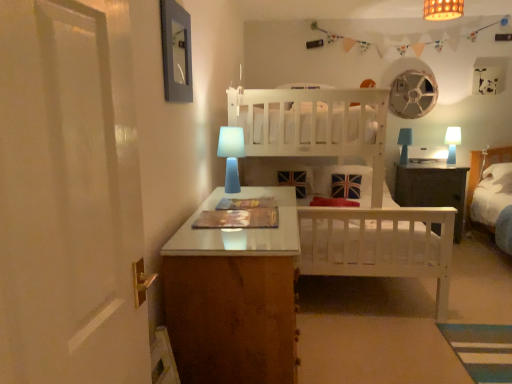
What is the approximate height of matte gray picture frame at upper left?

The height of matte gray picture frame at upper left is 16.38 inches.

Describe the element at coordinates (452, 143) in the screenshot. I see `blue matte table lamp at right, marked as the 1th table lamp in a right-to-left arrangement` at that location.

The width and height of the screenshot is (512, 384). What do you see at coordinates (442, 9) in the screenshot?
I see `bamboo lampshade at upper center` at bounding box center [442, 9].

What is the approximate height of blue matte table lamp at right, which is the second table lamp in right-to-left order?

It is 14.99 inches.

This screenshot has height=384, width=512. I want to click on blue matte table lamp at center, which appears as the first table lamp when viewed from the left, so click(x=231, y=155).

What are the coordinates of `white wooden bed at center` in the screenshot? It's located at (349, 208).

I want to click on white fabric pillow at right, so click(498, 178).

Considering the positions of objects white fabric pillow at right and blue matte table lamp at center, which appears as the first table lamp when viewed from the left, in the image provided, who is more to the right, white fabric pillow at right or blue matte table lamp at center, which appears as the first table lamp when viewed from the left,?

white fabric pillow at right is more to the right.

Which is behind, point (507, 170) or point (231, 177)?

Positioned behind is point (507, 170).

Starting from the bamboo lampshade at upper center, which table lamp is the 3rd one behind? Please provide its 2D coordinates.

[(404, 144)]

Would you consider blue matte table lamp at right, which is counted as the 2th table lamp, starting from the left, to be distant from bamboo lampshade at upper center?

Yes, blue matte table lamp at right, which is counted as the 2th table lamp, starting from the left, and bamboo lampshade at upper center are located far from each other.

Between point (407, 134) and point (446, 8), which one is positioned in front?

The point (446, 8) is in front.

Which of these two, blue matte table lamp at right, the first table lamp from the back, or white fabric pillow at right, stands shorter?

Standing shorter between the two is white fabric pillow at right.

Is blue matte table lamp at right, which is the second table lamp in right-to-left order, not near white fabric pillow at right?

That's right, there is a large distance between blue matte table lamp at right, which is the second table lamp in right-to-left order, and white fabric pillow at right.

Which object is positioned more to the left, blue matte table lamp at right, which is counted as the 2th table lamp, starting from the left, or white fabric pillow at right?

blue matte table lamp at right, which is counted as the 2th table lamp, starting from the left.

Considering the sizes of blue matte table lamp at right, which is the second table lamp in right-to-left order, and white fabric pillow at right in the image, is blue matte table lamp at right, which is the second table lamp in right-to-left order, wider or thinner than white fabric pillow at right?

blue matte table lamp at right, which is the second table lamp in right-to-left order, is thinner than white fabric pillow at right.

Is matte gray picture frame at upper left smaller than blue matte table lamp at right, which is the second table lamp in right-to-left order?

Yes.

From a real-world perspective, relative to blue matte table lamp at right, the first table lamp from the back, is matte gray picture frame at upper left vertically above or below?

matte gray picture frame at upper left is situated higher than blue matte table lamp at right, the first table lamp from the back, in the real world.

How much distance is there between matte gray picture frame at upper left and blue matte table lamp at right, the first table lamp from the back?

matte gray picture frame at upper left and blue matte table lamp at right, the first table lamp from the back, are 10.33 feet apart.

Is matte gray picture frame at upper left touching blue matte table lamp at right, which is counted as the 2th table lamp, starting from the left?

No, matte gray picture frame at upper left is not in contact with blue matte table lamp at right, which is counted as the 2th table lamp, starting from the left.

Which point is more forward, (236, 91) or (405, 150)?

Point (236, 91)

Can you confirm if white wooden bed at center is shorter than blue matte table lamp at right, which ranks as the third table lamp in front-to-back order?

No, white wooden bed at center is not shorter than blue matte table lamp at right, which ranks as the third table lamp in front-to-back order.

Is white wooden bed at center outside of blue matte table lamp at right, which ranks as the third table lamp in front-to-back order?

Yes, white wooden bed at center is outside of blue matte table lamp at right, which ranks as the third table lamp in front-to-back order.

Looking at this image, does white wooden bed at center have a smaller size compared to blue matte table lamp at right, which ranks as the third table lamp in front-to-back order?

Actually, white wooden bed at center might be larger than blue matte table lamp at right, which ranks as the third table lamp in front-to-back order.

Between blue matte table lamp at right, acting as the third table lamp starting from the left, and blue matte table lamp at right, the first table lamp from the back, which one has larger width?

blue matte table lamp at right, the first table lamp from the back, is wider.

Between blue matte table lamp at right, marked as the 1th table lamp in a right-to-left arrangement, and blue matte table lamp at right, which ranks as the third table lamp in front-to-back order, which one has larger size?

Bigger between the two is blue matte table lamp at right, which ranks as the third table lamp in front-to-back order.

Is blue matte table lamp at right, which is counted as the second table lamp, starting from the front, oriented towards blue matte table lamp at right, which ranks as the third table lamp in front-to-back order?

No.

Looking at this image, which is in front, blue matte table lamp at right, acting as the third table lamp starting from the left, or blue matte table lamp at right, which is the second table lamp in right-to-left order?

blue matte table lamp at right, acting as the third table lamp starting from the left, is closer to the camera.

From a real-world perspective, is white fabric pillow at right over blue matte table lamp at right, acting as the third table lamp starting from the left?

No, from a real-world perspective, white fabric pillow at right is not over blue matte table lamp at right, acting as the third table lamp starting from the left

Considering the sizes of objects white fabric pillow at right and blue matte table lamp at right, marked as the 1th table lamp in a right-to-left arrangement, in the image provided, who is taller, white fabric pillow at right or blue matte table lamp at right, marked as the 1th table lamp in a right-to-left arrangement,?

blue matte table lamp at right, marked as the 1th table lamp in a right-to-left arrangement.

From the image's perspective, would you say white fabric pillow at right is positioned over blue matte table lamp at right, which is counted as the second table lamp, starting from the front?

No.

Between point (501, 166) and point (449, 151), which one is positioned behind?

The point (501, 166) is more distant.

I want to click on pillow that is on the right side of blue matte table lamp at center, which appears as the first table lamp when viewed from the left, so click(498, 178).

I want to click on light fixture to the left of blue matte table lamp at right, which is the second table lamp in right-to-left order, so click(x=442, y=9).

From the image, which object appears to be nearer to blue matte table lamp at right, which ranks as the third table lamp in front-to-back order, blue matte table lamp at right, acting as the third table lamp starting from the left, or blue matte table lamp at center, acting as the 3th table lamp starting from the right?

The object closer to blue matte table lamp at right, which ranks as the third table lamp in front-to-back order, is blue matte table lamp at right, acting as the third table lamp starting from the left.

Based on their spatial positions, is blue matte table lamp at right, the first table lamp from the back, or blue matte table lamp at right, arranged as the second table lamp when viewed from the back, closer to matte gray picture frame at upper left?

blue matte table lamp at right, the first table lamp from the back, is positioned closer to the anchor matte gray picture frame at upper left.

Which object lies further to the anchor point white wooden bed at center, dark wood nightstand at center or bamboo lampshade at upper center?

bamboo lampshade at upper center is positioned further to the anchor white wooden bed at center.

Looking at the image, which one is located further to dark wood nightstand at center, white fabric pillow at right or bamboo lampshade at upper center?

bamboo lampshade at upper center lies further to dark wood nightstand at center than the other object.

Looking at the image, which one is located further to matte gray picture frame at upper left, bamboo lampshade at upper center or blue matte table lamp at right, which is counted as the 2th table lamp, starting from the left?

blue matte table lamp at right, which is counted as the 2th table lamp, starting from the left, is positioned further to the anchor matte gray picture frame at upper left.

Considering their positions, is bamboo lampshade at upper center positioned further to blue matte table lamp at right, the first table lamp from the back, than dark wood nightstand at center?

The object further to blue matte table lamp at right, the first table lamp from the back, is bamboo lampshade at upper center.

Considering their positions, is matte gray picture frame at upper left positioned further to white fabric pillow at right than blue matte table lamp at right, marked as the 1th table lamp in a right-to-left arrangement?

matte gray picture frame at upper left lies further to white fabric pillow at right than the other object.

Based on their spatial positions, is bamboo lampshade at upper center or blue matte table lamp at center, the third table lamp when ordered from back to front, further from blue matte table lamp at right, which ranks as the third table lamp in front-to-back order?

blue matte table lamp at center, the third table lamp when ordered from back to front, is further to blue matte table lamp at right, which ranks as the third table lamp in front-to-back order.

You are a GUI agent. You are given a task and a screenshot of the screen. Output one action in this format:
    pyautogui.click(x=<x>, y=<y>)
    Task: Click on the bed between blue matte table lamp at center, the third table lamp when ordered from back to front, and white fabric pillow at right from left to right
    The image size is (512, 384).
    Given the screenshot: What is the action you would take?
    pyautogui.click(x=349, y=208)

This screenshot has width=512, height=384. Identify the location of table lamp between matte gray picture frame at upper left and blue matte table lamp at right, marked as the 1th table lamp in a right-to-left arrangement, in the front-back direction. (231, 155).

Image resolution: width=512 pixels, height=384 pixels. Find the location of `nightstand situated between blue matte table lamp at center, the 1th table lamp in the front-to-back sequence, and blue matte table lamp at right, arranged as the second table lamp when viewed from the back, from left to right`. nightstand situated between blue matte table lamp at center, the 1th table lamp in the front-to-back sequence, and blue matte table lamp at right, arranged as the second table lamp when viewed from the back, from left to right is located at coordinates (432, 188).

This screenshot has height=384, width=512. Find the location of `table lamp between bamboo lampshade at upper center and blue matte table lamp at right, which is counted as the second table lamp, starting from the front, in the front-back direction`. table lamp between bamboo lampshade at upper center and blue matte table lamp at right, which is counted as the second table lamp, starting from the front, in the front-back direction is located at coordinates (231, 155).